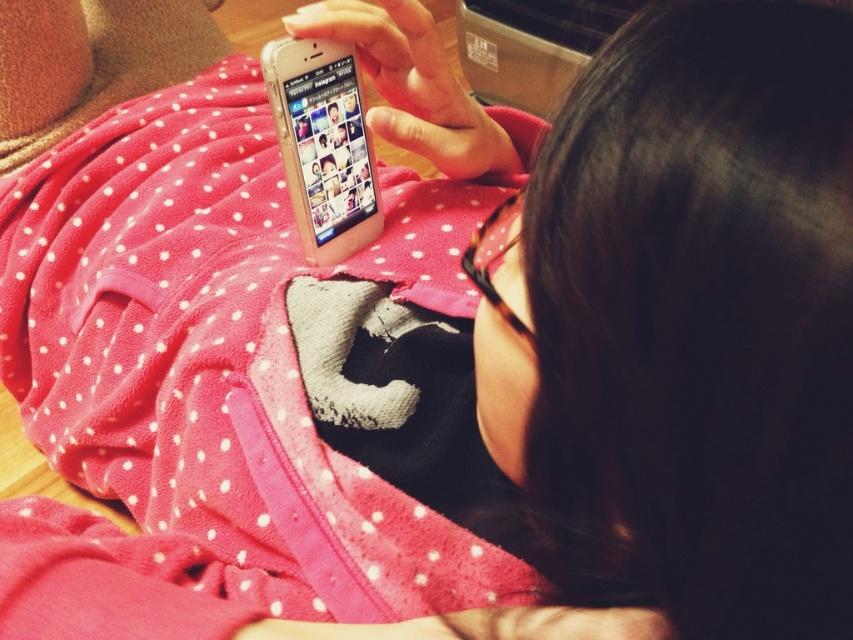
You are a photographer trying to capture a close shot of the smartphone screen. You notice two points in the scene at coordinates point (68, 378) and point (320, 216). Which point should you focus on to ensure the smartphone screen is in focus?

You should focus on point (68, 378) because it is closer to the viewer than point (320, 216), which means it aligns better with the smartphone screen depth.

You are trying to decide whether to place a new book on the pink fleece blanket at center or the clear plastic phone at center. Based on their sizes, which item can better accommodate the book?

The pink fleece blanket at center is larger in size than the clear plastic phone at center, so the book would better fit on the pink fleece blanket at center.

You are a delivery robot trying to place a package on the wooden surface in the background. The package is 0.3 meters wide. Can you fit the package between the point marked at (x=207, y=385) and the edge of the wooden surface?

The point marked at (x=207, y=385) marks the pink fleece blanket at center. Since the package is 0.3 meters wide and the distance between the blanket and the edge is not provided, it is impossible to determine if it will fit.